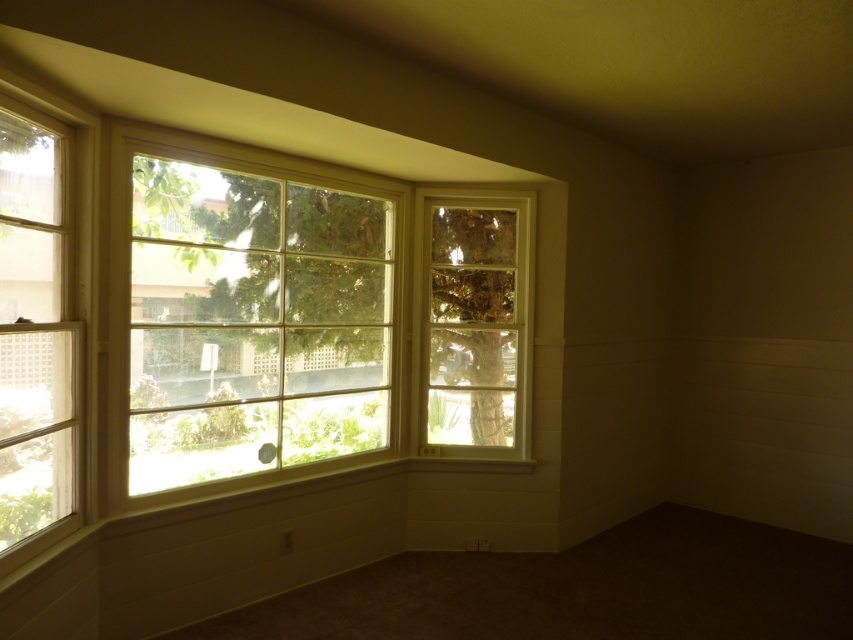
You are an interior designer planning to install a new decorative sticker on the larger window. Based on the scene description, which window should you choose between the white wood window at upper left and the clear glass window at center?

The white wood window at upper left is bigger than the clear glass window at center, so you should choose the white wood window at upper left to install the decorative sticker.

You are a painter who wants to place a 1.2 meter wide canvas between the white wood window at upper left and the clear glass window at left. Can the canvas fit between them?

The distance between the white wood window at upper left and the clear glass window at left is 78.82 centimeters, which is less than the 1.2 meter width of the canvas. Therefore, the canvas cannot fit between them.

You are standing in the room and want to look outside through both the clear glass window at left and the clear glass window at center. Which window do you need to step back from to see the tree trunk outside?

You need to step back from the clear glass window at left because it is in front of the clear glass window at center, so moving back would allow you to see through the clear glass window at center where the tree trunk is visible.